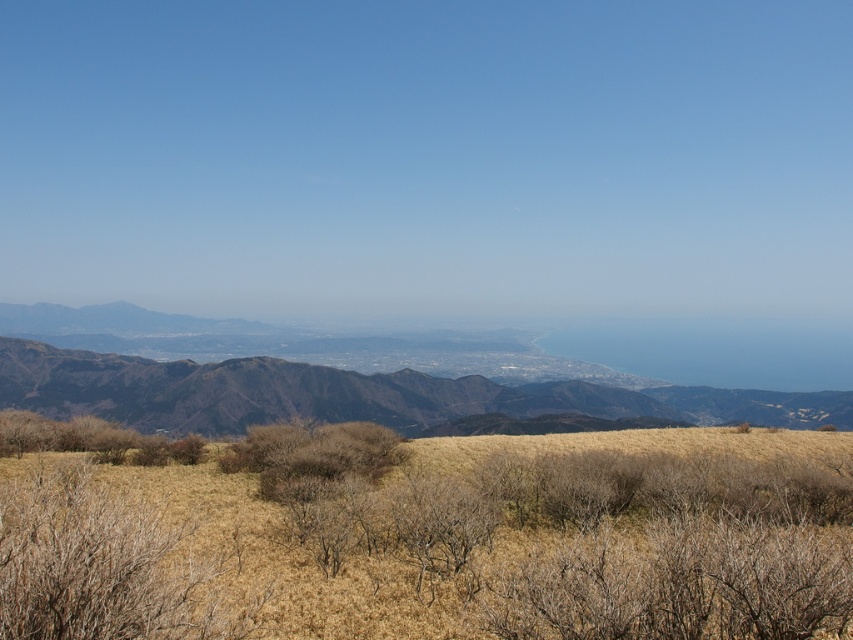
Question: Which point is closer to the camera?

Choices:
 (A) dry grass at center
 (B) brown textured mountain range at center

Answer: (A)

Question: Is dry grass at center smaller than brown textured mountain range at center?

Choices:
 (A) yes
 (B) no

Answer: (A)

Question: Can you confirm if dry grass at center is thinner than brown textured mountain range at center?

Choices:
 (A) no
 (B) yes

Answer: (B)

Question: From the image, what is the correct spatial relationship of dry grass at center in relation to brown textured mountain range at center?

Choices:
 (A) right
 (B) left

Answer: (B)

Question: Which point is farther to the camera?

Choices:
 (A) (738, 403)
 (B) (670, 580)

Answer: (A)